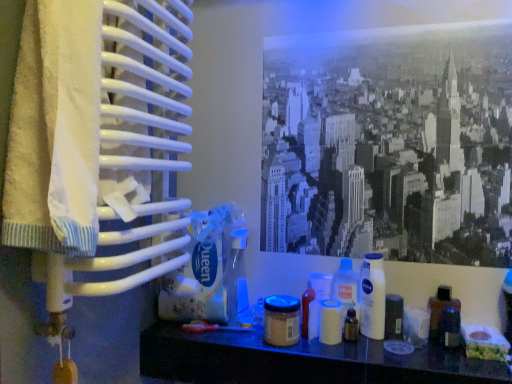
Find the location of a particular element. vacant area that is in front of transparent plastic bottle at center, the seventh toiletry viewed from the right is located at coordinates point(241,346).